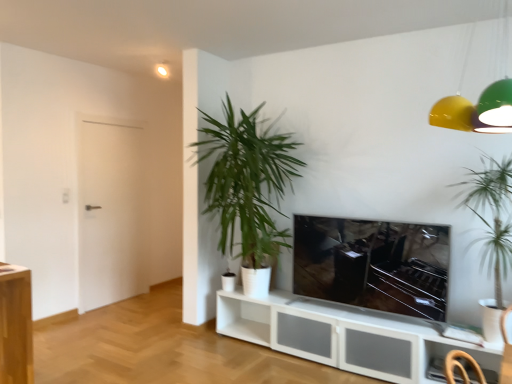
Question: Should I look upward or downward to see matte black tv at center?

Choices:
 (A) up
 (B) down

Answer: (B)

Question: Is white matte door at left located within matte black tv at center?

Choices:
 (A) yes
 (B) no

Answer: (B)

Question: From the image's perspective, is matte black tv at center below white matte door at left?

Choices:
 (A) yes
 (B) no

Answer: (A)

Question: Does matte black tv at center have a smaller size compared to white matte door at left?

Choices:
 (A) no
 (B) yes

Answer: (B)

Question: Does matte black tv at center come behind white matte door at left?

Choices:
 (A) no
 (B) yes

Answer: (A)

Question: Is matte black tv at center positioned in front of white matte door at left?

Choices:
 (A) yes
 (B) no

Answer: (A)

Question: Does matte black tv at center have a lesser height compared to white matte door at left?

Choices:
 (A) yes
 (B) no

Answer: (A)

Question: Is yellow matte lampshade at upper right looking in the opposite direction of white matte door at left?

Choices:
 (A) no
 (B) yes

Answer: (A)

Question: Is yellow matte lampshade at upper right bigger than white matte door at left?

Choices:
 (A) yes
 (B) no

Answer: (A)

Question: Is yellow matte lampshade at upper right next to white matte door at left?

Choices:
 (A) yes
 (B) no

Answer: (B)

Question: Is yellow matte lampshade at upper right far away from white matte door at left?

Choices:
 (A) no
 (B) yes

Answer: (B)

Question: Can you confirm if yellow matte lampshade at upper right is wider than white matte door at left?

Choices:
 (A) no
 (B) yes

Answer: (B)

Question: Could you tell me if yellow matte lampshade at upper right is facing white matte door at left?

Choices:
 (A) no
 (B) yes

Answer: (B)

Question: Considering the relative positions of white matte door at left and green leafy plant at center, marked as the first houseplant in a back-to-front arrangement, in the image provided, is white matte door at left to the left of green leafy plant at center, marked as the first houseplant in a back-to-front arrangement, from the viewer's perspective?

Choices:
 (A) yes
 (B) no

Answer: (A)